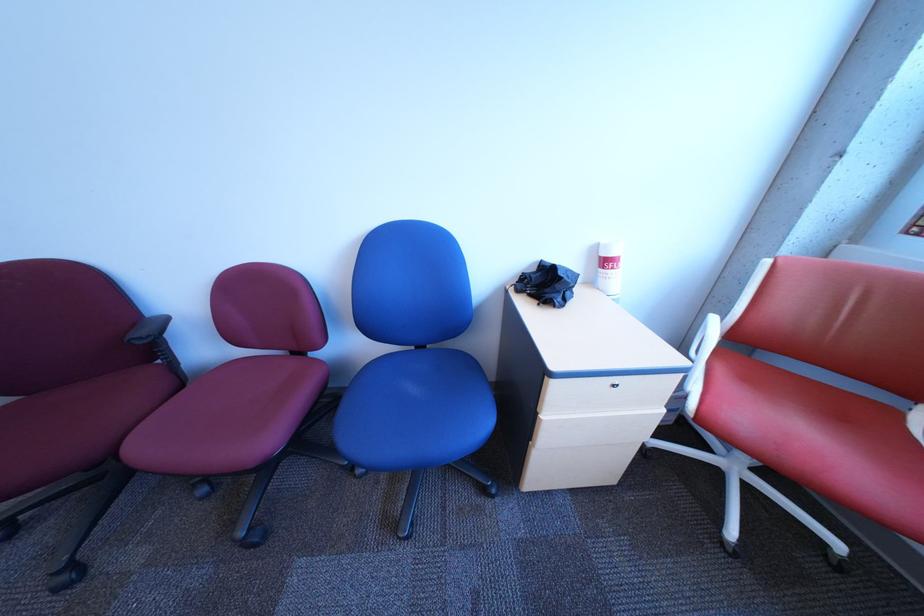
What do you see at coordinates (614, 384) in the screenshot? I see `the drawer lock` at bounding box center [614, 384].